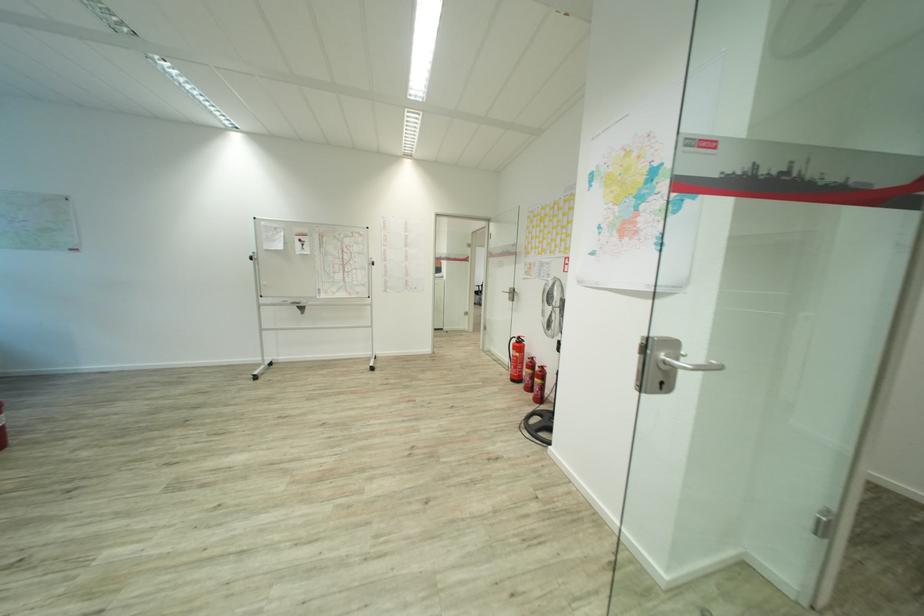
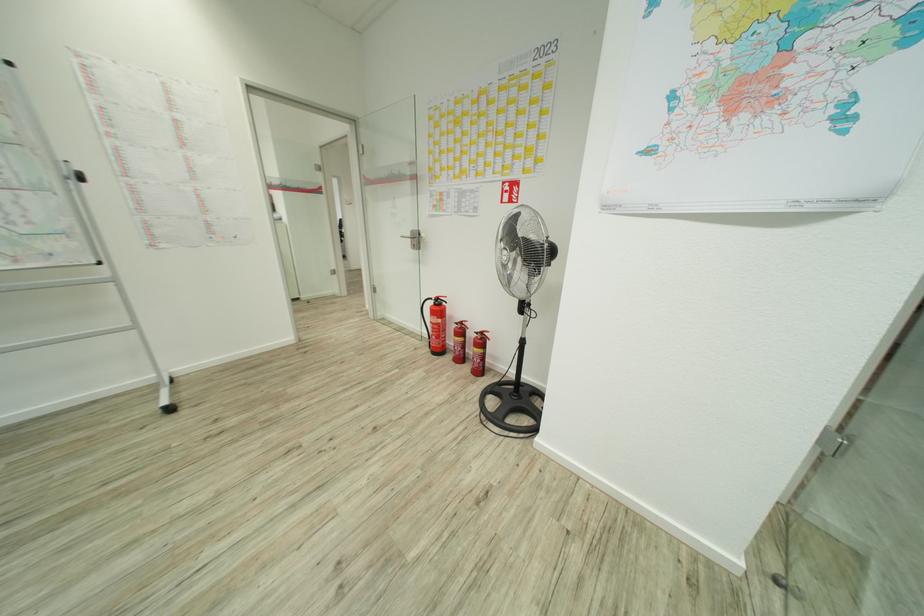
The point at (x=512, y=294) is marked in the first image. Where is the corresponding point in the second image?

(416, 238)